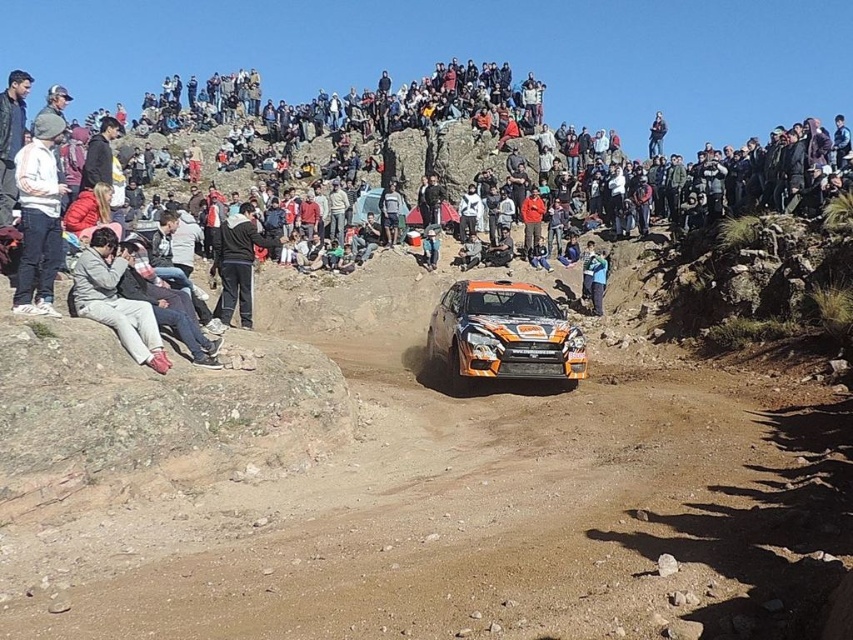
Question: Which object is positioned closest to the orange matte rally car at center?

Choices:
 (A) white fleece jacket at upper left
 (B) light gray fabric pants at lower left
 (C) orange matte dirt track at center

Answer: (C)

Question: Can you confirm if orange matte car at center is positioned below orange matte rally car at center?

Choices:
 (A) no
 (B) yes

Answer: (A)

Question: Can you confirm if orange matte car at center is positioned below orange matte rally car at center?

Choices:
 (A) no
 (B) yes

Answer: (A)

Question: Does orange matte dirt track at center lie in front of orange matte car at center?

Choices:
 (A) no
 (B) yes

Answer: (B)

Question: Based on their relative distances, which object is farther from the orange matte car at center?

Choices:
 (A) orange matte dirt track at center
 (B) white fleece jacket at upper left

Answer: (B)

Question: Which object is farther from the camera taking this photo?

Choices:
 (A) light gray fabric pants at lower left
 (B) orange matte rally car at center
 (C) white fleece jacket at upper left

Answer: (B)